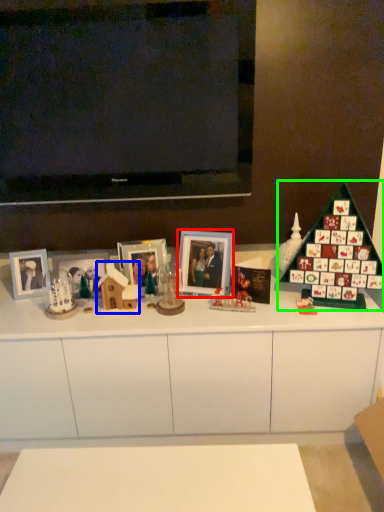
Question: Which is farther away from picture frame (highlighted by a red box)? toy (highlighted by a blue box) or christmas tree (highlighted by a green box)?

Choices:
 (A) toy
 (B) christmas tree

Answer: (B)